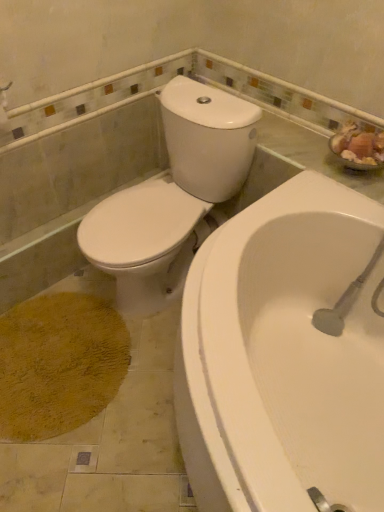
Identify the location of white glossy bathtub at lower right. The image size is (384, 512). (283, 355).

What do you see at coordinates (283, 355) in the screenshot? The height and width of the screenshot is (512, 384). I see `white glossy bathtub at lower right` at bounding box center [283, 355].

This screenshot has height=512, width=384. Describe the element at coordinates (172, 194) in the screenshot. I see `white glossy toilet at upper left` at that location.

Where is `white glossy toilet at upper left`? white glossy toilet at upper left is located at coordinates 172,194.

This screenshot has width=384, height=512. I want to click on white glossy bathtub at lower right, so click(283, 355).

Considering the relative positions of white glossy bathtub at lower right and white glossy toilet at upper left in the image provided, is white glossy bathtub at lower right to the left of white glossy toilet at upper left from the viewer's perspective?

In fact, white glossy bathtub at lower right is to the right of white glossy toilet at upper left.

Is white glossy bathtub at lower right in front of or behind white glossy toilet at upper left in the image?

Visually, white glossy bathtub at lower right is located in front of white glossy toilet at upper left.

Is point (330, 407) positioned after point (183, 154)?

No, (330, 407) is closer to viewer.

From the image's perspective, which object appears higher, white glossy bathtub at lower right or white glossy toilet at upper left?

white glossy toilet at upper left.

From a real-world perspective, is white glossy bathtub at lower right on top of white glossy toilet at upper left?

Incorrect, from a real-world perspective, white glossy bathtub at lower right is lower than white glossy toilet at upper left.

In terms of width, does white glossy bathtub at lower right look wider or thinner when compared to white glossy toilet at upper left?

In the image, white glossy bathtub at lower right appears to be wider than white glossy toilet at upper left.

Does white glossy bathtub at lower right have a greater height compared to white glossy toilet at upper left?

No, white glossy bathtub at lower right is not taller than white glossy toilet at upper left.

Which of these two, white glossy bathtub at lower right or white glossy toilet at upper left, is smaller?

Smaller between the two is white glossy toilet at upper left.

Is white glossy bathtub at lower right outside of white glossy toilet at upper left?

white glossy bathtub at lower right is positioned outside white glossy toilet at upper left.

Based on the photo, would you say white glossy bathtub at lower right is a long distance from white glossy toilet at upper left?

They are positioned close to each other.

Is white glossy bathtub at lower right positioned with its back to white glossy toilet at upper left?

white glossy bathtub at lower right does not have its back to white glossy toilet at upper left.

Can you tell me how much white glossy bathtub at lower right and white glossy toilet at upper left differ in facing direction?

0.364 degrees.

You are a GUI agent. You are given a task and a screenshot of the screen. Output one action in this format:
    pyautogui.click(x=<x>, y=<y>)
    Task: Click on the bathtub located in front of the white glossy toilet at upper left
    
    Given the screenshot: What is the action you would take?
    pyautogui.click(x=283, y=355)

Which object is positioned more to the right, white glossy toilet at upper left or white glossy bathtub at lower right?

Positioned to the right is white glossy bathtub at lower right.

Is white glossy toilet at upper left in front of white glossy bathtub at lower right?

No, it is behind white glossy bathtub at lower right.

Considering the positions of points (242, 137) and (210, 495), is point (242, 137) closer to camera compared to point (210, 495)?

No, (242, 137) is behind (210, 495).

From the image's perspective, is white glossy toilet at upper left located above or below white glossy bathtub at lower right?

Clearly, from the image's perspective, white glossy toilet at upper left is above white glossy bathtub at lower right.

From a real-world perspective, which object stands above the other?

From a 3D spatial view, white glossy toilet at upper left is above.

Is white glossy toilet at upper left wider than white glossy bathtub at lower right?

No, white glossy toilet at upper left is not wider than white glossy bathtub at lower right.

Does white glossy toilet at upper left have a greater height compared to white glossy bathtub at lower right?

Correct, white glossy toilet at upper left is much taller as white glossy bathtub at lower right.

Which of these two, white glossy toilet at upper left or white glossy bathtub at lower right, is smaller?

Smaller between the two is white glossy toilet at upper left.

Is white glossy toilet at upper left spatially inside white glossy bathtub at lower right, or outside of it?

white glossy toilet at upper left cannot be found inside white glossy bathtub at lower right.

Is there a large distance between white glossy toilet at upper left and white glossy bathtub at lower right?

white glossy toilet at upper left is actually quite close to white glossy bathtub at lower right.

Is white glossy bathtub at lower right at the back of white glossy toilet at upper left?

white glossy toilet at upper left does not have its back to white glossy bathtub at lower right.

Can you tell me how much white glossy toilet at upper left and white glossy bathtub at lower right differ in facing direction?

0.364 degrees separate the facing orientations of white glossy toilet at upper left and white glossy bathtub at lower right.

This screenshot has width=384, height=512. I want to click on bathtub below the white glossy toilet at upper left (from a real-world perspective), so click(x=283, y=355).

At what (x,y) coordinates should I click in order to perform the action: click on toilet located behind the white glossy bathtub at lower right. Please return your answer as a coordinate pair (x, y). The image size is (384, 512). Looking at the image, I should click on (172, 194).

Where is `bathtub in front of the white glossy toilet at upper left`? The width and height of the screenshot is (384, 512). bathtub in front of the white glossy toilet at upper left is located at coordinates (283, 355).